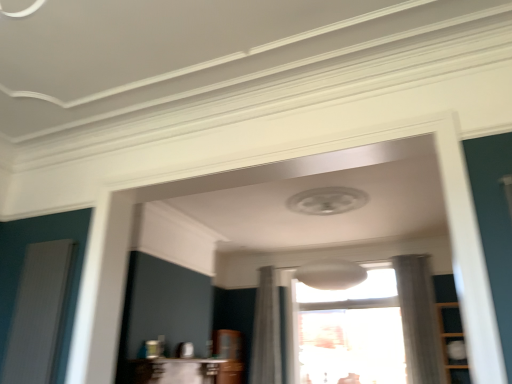
Question: Looking at the image, does white ribbed screen door at left seem bigger or smaller compared to transparent glass window at center?

Choices:
 (A) big
 (B) small

Answer: (B)

Question: From a real-world perspective, is white ribbed screen door at left above or below transparent glass window at center?

Choices:
 (A) below
 (B) above

Answer: (A)

Question: Estimate the real-world distances between objects in this image. Which object is closer to the white sheer curtain at right, arranged as the second curtain when viewed from the left?

Choices:
 (A) transparent glass window at center
 (B) white sheer curtain at center, marked as the first curtain in a left-to-right arrangement
 (C) white ribbed screen door at left
 (D) wooden cabinet at right

Answer: (D)

Question: Which of these objects is positioned closest to the wooden cabinet at right?

Choices:
 (A) transparent glass window at center
 (B) white ribbed screen door at left
 (C) white sheer curtain at right, which is the first curtain in right-to-left order
 (D) white sheer curtain at center, which ranks as the second curtain in right-to-left order

Answer: (C)